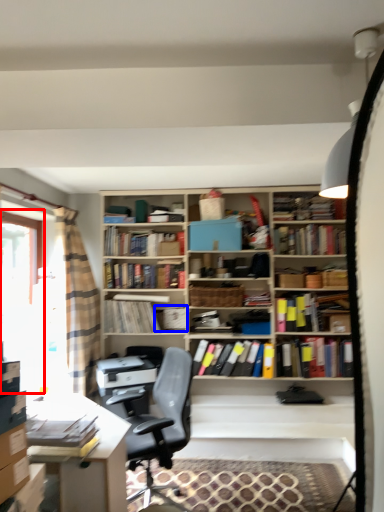
Question: Which point is closer to the camera, window screen (highlighted by a red box) or book (highlighted by a blue box)?

Choices:
 (A) window screen
 (B) book

Answer: (A)